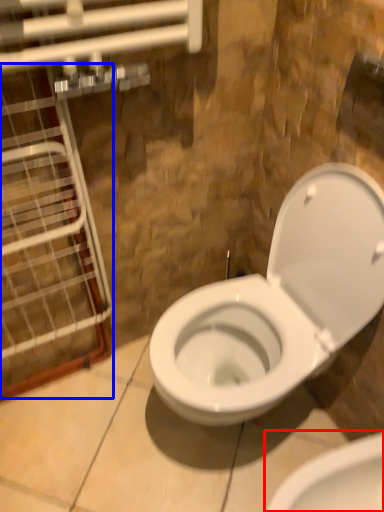
Question: Among these objects, which one is farthest to the camera, toilet (highlighted by a red box) or glass door (highlighted by a blue box)?

Choices:
 (A) toilet
 (B) glass door

Answer: (A)